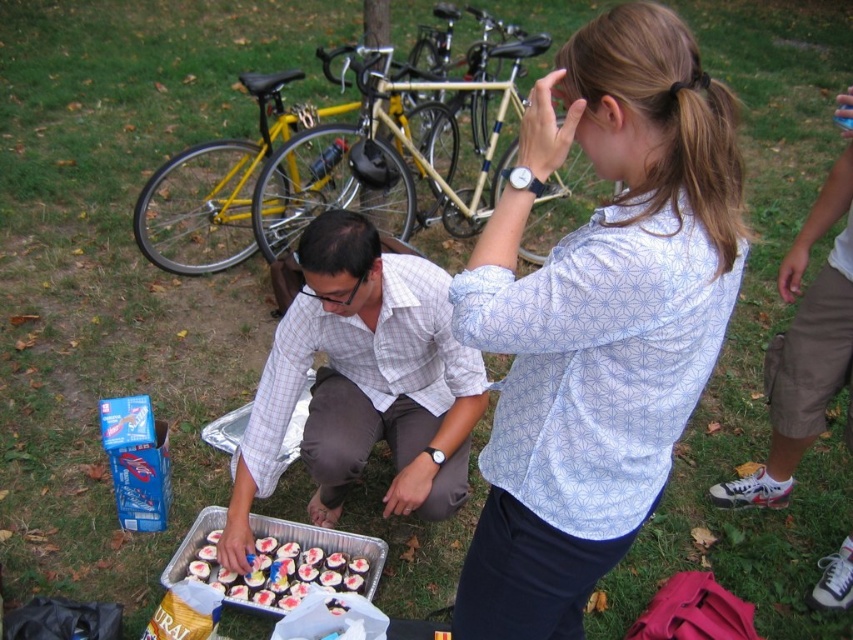
Who is more distant from viewer, (492, 44) or (387, 312)?

The point (492, 44) is behind.

Identify the location of yellow matte bicycle at upper left. This screenshot has width=853, height=640. (326, 166).

Between point (273, 170) and point (271, 605), which one is positioned in front?

Point (271, 605) is more forward.

Which of these two, yellow matte bicycle at upper left or chocolate frosted cupcakes at lower center, stands taller?

Standing taller between the two is yellow matte bicycle at upper left.

Which is behind, point (422, 164) or point (305, 582)?

Point (422, 164)

Find the location of `yellow matte bicycle at upper left`. yellow matte bicycle at upper left is located at coordinates (326, 166).

Is point (703, 198) behind point (363, 396)?

That is False.

Between point (701, 307) and point (334, 481), which one is positioned in front?

Positioned in front is point (701, 307).

Between point (583, 396) and point (381, 292), which one is positioned in front?

Point (583, 396) is more forward.

Where is `white printed shirt at center`? The image size is (853, 640). white printed shirt at center is located at coordinates (598, 320).